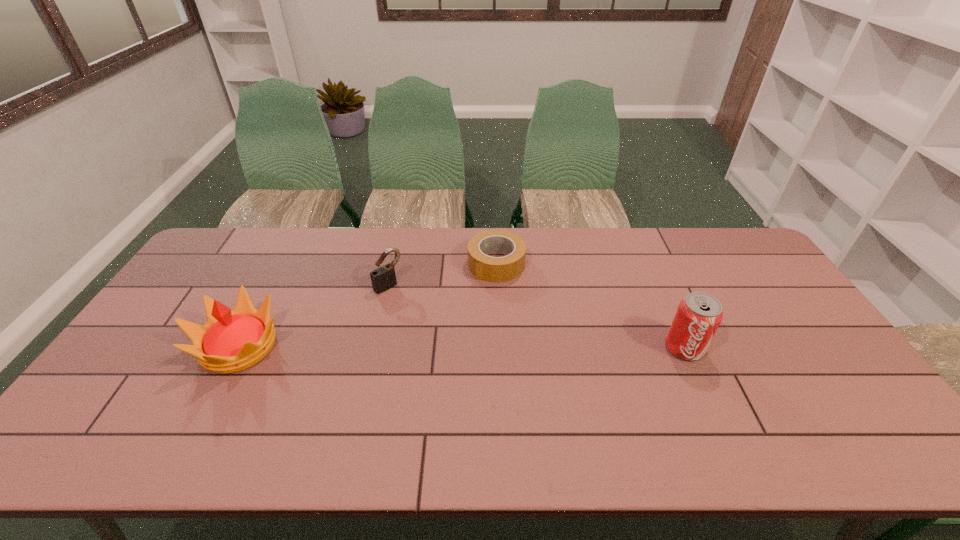
Locate an element on the screen. This screenshot has width=960, height=540. blank area at the near left corner is located at coordinates (104, 389).

Find the location of `vacant space that is in between the crown and the rightmost object`. vacant space that is in between the crown and the rightmost object is located at coordinates (462, 347).

This screenshot has height=540, width=960. What are the coordinates of `unoccupied position between the leftmost object and the rightmost object` in the screenshot? It's located at (462, 347).

This screenshot has width=960, height=540. I want to click on free spot between the padlock and the leftmost object, so click(x=314, y=316).

Locate an element on the screen. This screenshot has height=540, width=960. empty space between the leftmost object and the duct tape is located at coordinates (x=368, y=305).

Image resolution: width=960 pixels, height=540 pixels. Identify the location of vacant area between the padlock and the rightmost object. (537, 316).

Locate an element on the screen. Image resolution: width=960 pixels, height=540 pixels. vacant space that's between the second shortest object and the leftmost object is located at coordinates click(314, 316).

At what (x,y) coordinates should I click in order to perform the action: click on vacant area that lies between the crown and the third object from left to right. Please return your answer as a coordinate pair (x, y). Image resolution: width=960 pixels, height=540 pixels. Looking at the image, I should click on (368, 305).

The height and width of the screenshot is (540, 960). Find the location of `empty location between the padlock and the shortest object`. empty location between the padlock and the shortest object is located at coordinates (443, 275).

Where is `free space between the rightmost object and the leftmost object`? The image size is (960, 540). free space between the rightmost object and the leftmost object is located at coordinates (462, 347).